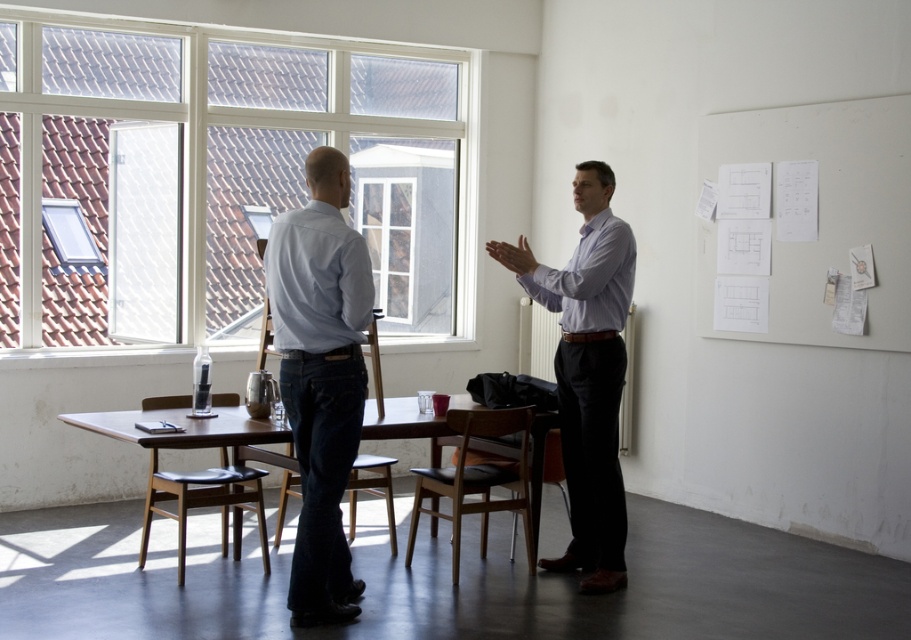
Question: Does white paper at upper right have a larger size compared to light blue shirt at center?

Choices:
 (A) yes
 (B) no

Answer: (A)

Question: Is light blue shirt at center wider than light brown wooden table at center?

Choices:
 (A) no
 (B) yes

Answer: (A)

Question: Which object appears closest to the camera in this image?

Choices:
 (A) light brown wooden table at center
 (B) white paper at upper right
 (C) denim jeans at center
 (D) dark wood chair at center

Answer: (C)

Question: Is light brown wooden table at center further to camera compared to dark wood chair at center?

Choices:
 (A) yes
 (B) no

Answer: (B)

Question: Which object appears farthest from the camera in this image?

Choices:
 (A) light brown wooden table at center
 (B) white paper at upper right

Answer: (B)

Question: Which of the following is the farthest from the observer?

Choices:
 (A) (814, 328)
 (B) (584, 406)

Answer: (A)